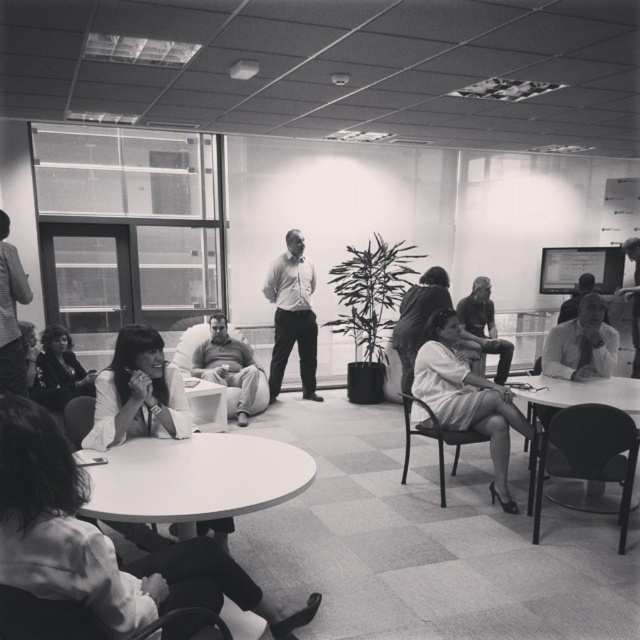
Question: Estimate the real-world distances between objects in this image. Which object is farther from the smooth beige pants at center?

Choices:
 (A) metallic silver chair at center
 (B) smooth white table at center
 (C) smooth white shirt at center
 (D) smooth black shirt at center

Answer: (C)

Question: Is white shirt at right positioned before smooth white shirt at right?

Choices:
 (A) no
 (B) yes

Answer: (B)

Question: Which of these objects is positioned closest to the black leather chair at lower left?

Choices:
 (A) smooth white shirt at right
 (B) smooth white shirt at center

Answer: (B)

Question: Can you confirm if matte white shirt at center is bigger than striped shirt at left?

Choices:
 (A) no
 (B) yes

Answer: (B)

Question: Based on their relative distances, which object is nearer to the smooth white shirt at right?

Choices:
 (A) black leather chair at lower left
 (B) smooth white table at center
 (C) matte white shirt at center

Answer: (C)

Question: Is smooth white table at center to the right of smooth white shirt at center from the viewer's perspective?

Choices:
 (A) yes
 (B) no

Answer: (B)